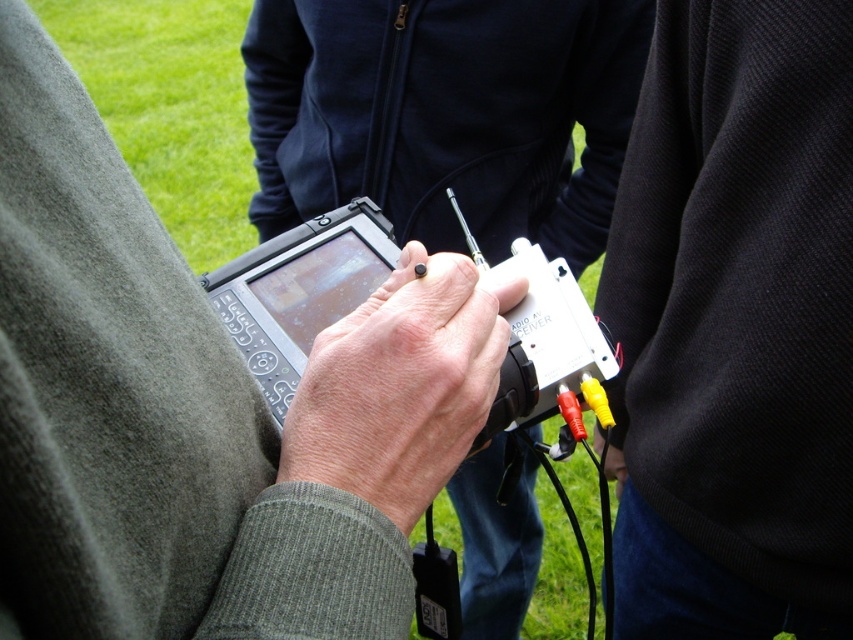
Between matte black tablet at center and black textured sweater at center, which one appears on the left side from the viewer's perspective?

Positioned to the left is matte black tablet at center.

Describe the element at coordinates (198, 410) in the screenshot. The image size is (853, 640). I see `matte black tablet at center` at that location.

Where is `matte black tablet at center`? The width and height of the screenshot is (853, 640). matte black tablet at center is located at coordinates (198, 410).

Is point (403, 326) farther from viewer compared to point (567, 429)?

No, it is not.

Is smooth skin hand at center bigger than white plastic video camera at center?

No.

Between point (440, 400) and point (264, 381), which one is positioned in front?

Point (440, 400) is more forward.

The width and height of the screenshot is (853, 640). I want to click on smooth skin hand at center, so click(x=401, y=385).

Who is taller, black textured sweater at center or smooth skin hand at center?

black textured sweater at center

Describe the element at coordinates (735, 324) in the screenshot. I see `black textured sweater at center` at that location.

Which is behind, point (721, 625) or point (426, 477)?

Positioned behind is point (721, 625).

This screenshot has width=853, height=640. Find the location of `black textured sweater at center`. black textured sweater at center is located at coordinates (735, 324).